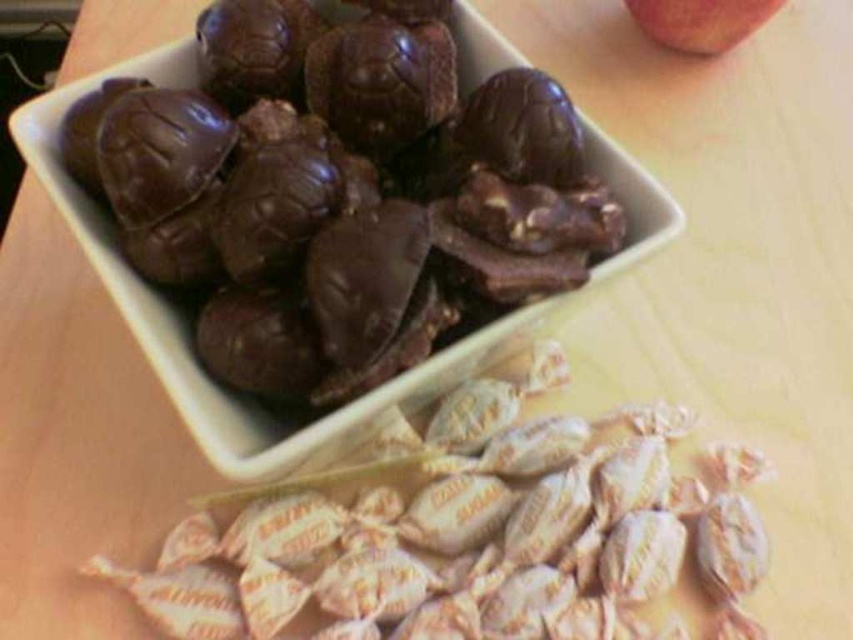
Does shiny chocolate candies at upper center have a smaller size compared to red matte apple at upper right?

No, shiny chocolate candies at upper center is not smaller than red matte apple at upper right.

Does shiny chocolate candies at upper center come behind red matte apple at upper right?

No, shiny chocolate candies at upper center is closer to the viewer.

Is point (263, 284) in front of point (688, 0)?

Yes, point (263, 284) is in front of point (688, 0).

Where is `shiny chocolate candies at upper center`? Image resolution: width=853 pixels, height=640 pixels. shiny chocolate candies at upper center is located at coordinates (338, 195).

Which is in front, point (546, 371) or point (769, 6)?

Point (546, 371) is in front.

Who is taller, white paper wrapped candy at lower center or red matte apple at upper right?

With more height is white paper wrapped candy at lower center.

Which is behind, point (407, 621) or point (720, 36)?

The point (720, 36) is more distant.

Where is `white paper wrapped candy at lower center`? The width and height of the screenshot is (853, 640). white paper wrapped candy at lower center is located at coordinates (473, 532).

Is point (229, 172) less distant than point (634, 445)?

Yes, it is in front of point (634, 445).

Who is positioned more to the left, shiny chocolate candies at upper center or white paper wrapped candy at lower center?

shiny chocolate candies at upper center is more to the left.

This screenshot has height=640, width=853. What are the coordinates of `shiny chocolate candies at upper center` in the screenshot? It's located at (338, 195).